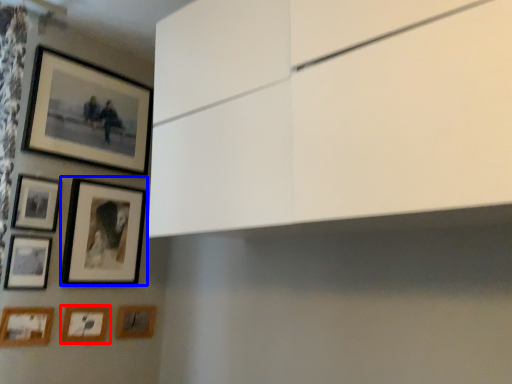
Question: Among these objects, which one is farthest to the camera, picture frame (highlighted by a red box) or picture frame (highlighted by a blue box)?

Choices:
 (A) picture frame
 (B) picture frame

Answer: (A)